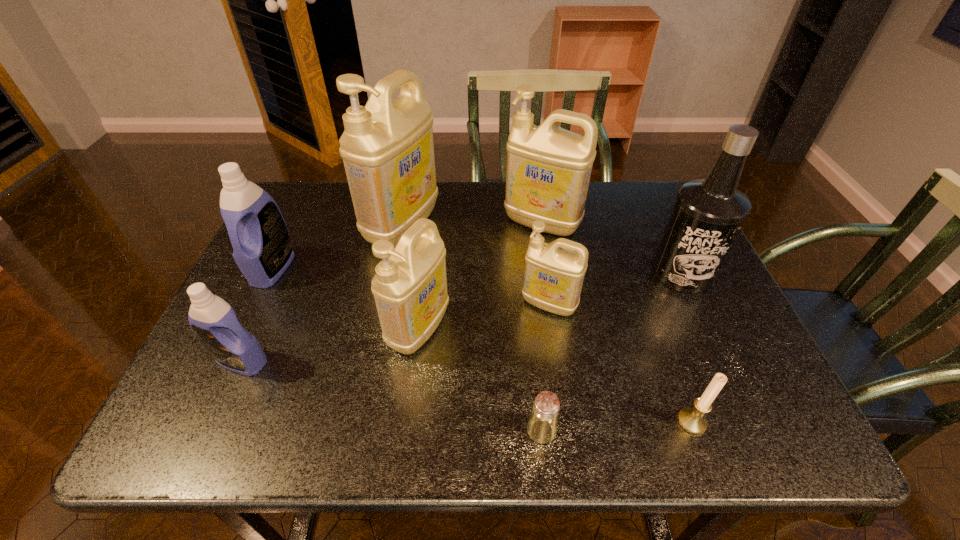
At what (x,y) coordinates should I click in order to perform the action: click on the tallest detergent. Please return your answer as a coordinate pair (x, y). The width and height of the screenshot is (960, 540). Looking at the image, I should click on (387, 147).

At what (x,y) coordinates should I click in order to perform the action: click on black liquor. Please return your answer as a coordinate pair (x, y). The width and height of the screenshot is (960, 540). Looking at the image, I should click on (708, 213).

The image size is (960, 540). I want to click on liquor, so click(708, 213).

Find the location of `the fifth shortest detergent`. the fifth shortest detergent is located at coordinates (548, 171).

The height and width of the screenshot is (540, 960). Find the location of `the second smallest beige detergent`. the second smallest beige detergent is located at coordinates coord(410,287).

The width and height of the screenshot is (960, 540). I want to click on the farther blue detergent, so click(262, 249).

The height and width of the screenshot is (540, 960). In order to click on the smallest beige detergent in this screenshot , I will do `click(553, 277)`.

The height and width of the screenshot is (540, 960). What are the coordinates of `the smaller blue detergent` in the screenshot? It's located at pyautogui.click(x=214, y=322).

At what (x,y) coordinates should I click in order to perform the action: click on candle holder. Please return your answer as a coordinate pair (x, y). Looking at the image, I should click on click(692, 420).

The image size is (960, 540). Find the location of `the second shortest object`. the second shortest object is located at coordinates (692, 420).